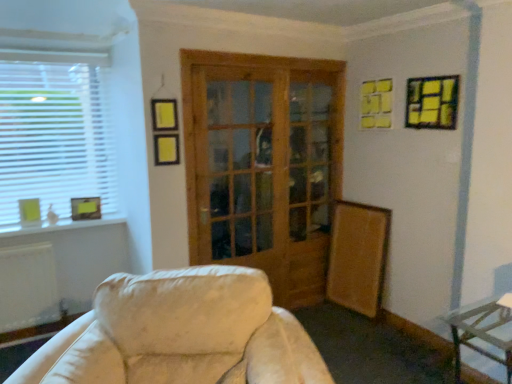
Question: Is yellow paper picture frame at upper right, acting as the 3th picture frame starting from the back, thinner than white plastic window at left?

Choices:
 (A) no
 (B) yes

Answer: (A)

Question: Would you say yellow paper picture frame at upper right, positioned as the third picture frame in bottom-to-top order, contains white plastic window at left?

Choices:
 (A) yes
 (B) no

Answer: (B)

Question: Does yellow paper picture frame at upper right, placed as the 1th picture frame when sorted from front to back, have a larger size compared to white plastic window at left?

Choices:
 (A) no
 (B) yes

Answer: (A)

Question: Can you confirm if yellow paper picture frame at upper right, placed as the 1th picture frame when sorted from front to back, is shorter than white plastic window at left?

Choices:
 (A) yes
 (B) no

Answer: (A)

Question: From the image's perspective, would you say yellow paper picture frame at upper right, which appears as the 3th picture frame when viewed from the left, is positioned over white plastic window at left?

Choices:
 (A) no
 (B) yes

Answer: (B)

Question: From the image's perspective, is metallic silver table at lower right located above or below matte yellow picture frame at left, which is counted as the second picture frame, starting from the front?

Choices:
 (A) above
 (B) below

Answer: (B)

Question: From a real-world perspective, is metallic silver table at lower right above or below matte yellow picture frame at left, acting as the third picture frame starting from the top?

Choices:
 (A) above
 (B) below

Answer: (B)

Question: Do you think metallic silver table at lower right is within matte yellow picture frame at left, the 2th picture frame when ordered from back to front, or outside of it?

Choices:
 (A) outside
 (B) inside

Answer: (A)

Question: In terms of size, does metallic silver table at lower right appear bigger or smaller than matte yellow picture frame at left, which is counted as the second picture frame, starting from the front?

Choices:
 (A) big
 (B) small

Answer: (A)

Question: In the image, is white plastic window at left positioned in front of or behind yellow paper picture frame at upper right, the first picture frame from the top?

Choices:
 (A) front
 (B) behind

Answer: (B)

Question: Considering the positions of point (42, 210) and point (437, 105), is point (42, 210) closer or farther from the camera than point (437, 105)?

Choices:
 (A) closer
 (B) farther

Answer: (B)

Question: Considering the positions of white plastic window at left and yellow paper picture frame at upper right, positioned as the first picture frame in right-to-left order, in the image, is white plastic window at left bigger or smaller than yellow paper picture frame at upper right, positioned as the first picture frame in right-to-left order,?

Choices:
 (A) big
 (B) small

Answer: (A)

Question: Visually, is white plastic window at left positioned to the left or to the right of yellow paper picture frame at upper right, which appears as the 3th picture frame when viewed from the left?

Choices:
 (A) left
 (B) right

Answer: (A)

Question: In terms of height, does metallic silver table at lower right look taller or shorter compared to yellow paper picture frame at upper right, acting as the 3th picture frame starting from the back?

Choices:
 (A) short
 (B) tall

Answer: (B)

Question: Considering their positions, is metallic silver table at lower right located in front of or behind yellow paper picture frame at upper right, positioned as the third picture frame in bottom-to-top order?

Choices:
 (A) front
 (B) behind

Answer: (A)